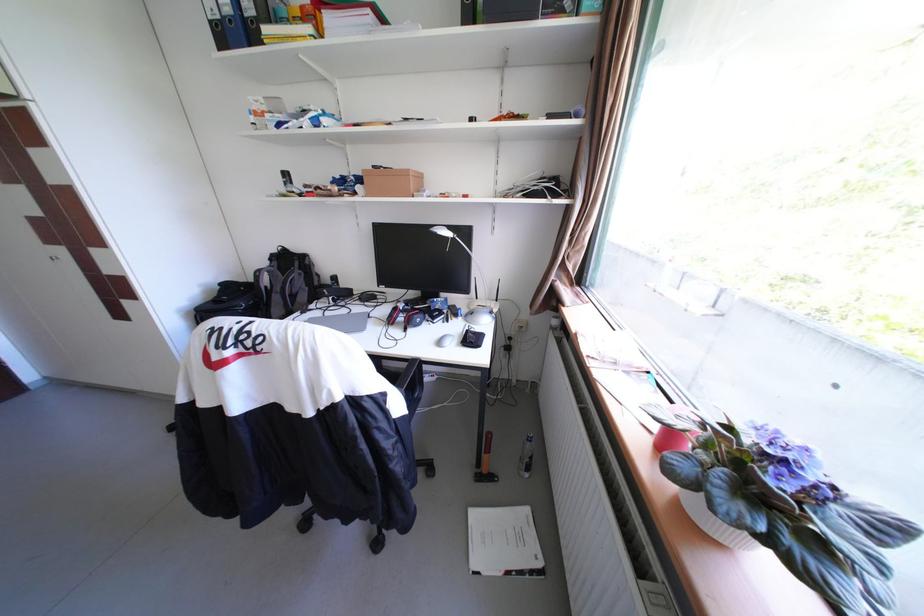
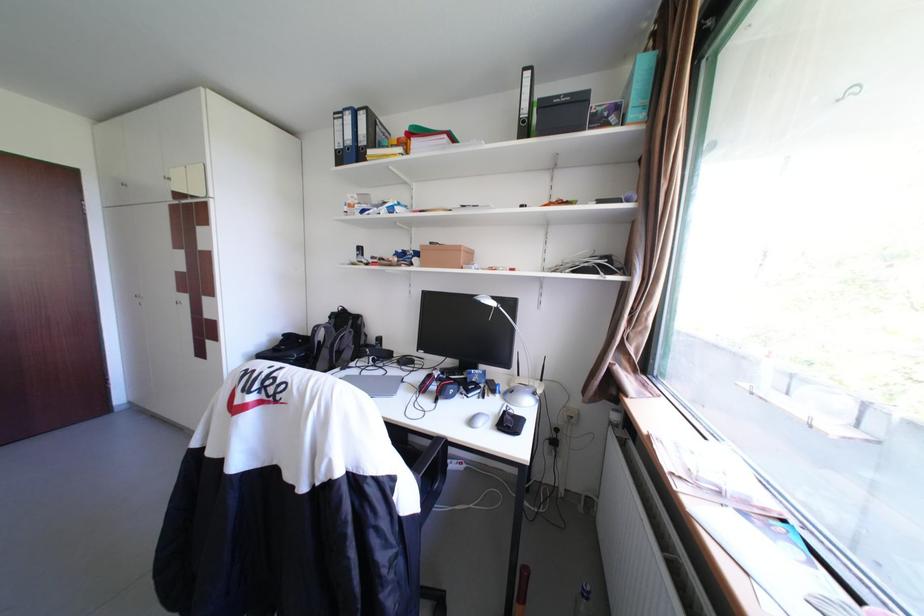
Find the pixel in the second image that matches point 286,264 in the first image.

(344, 321)